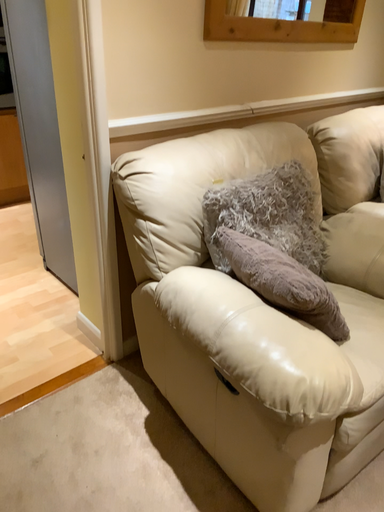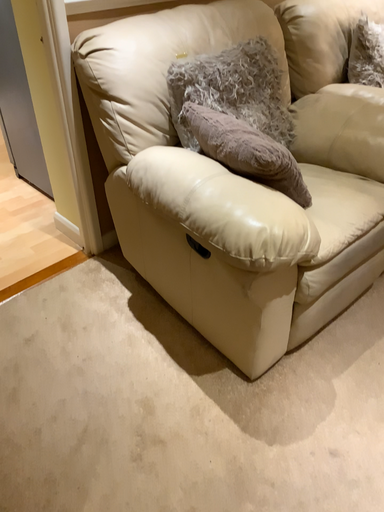
Question: Which way did the camera rotate in the video?

Choices:
 (A) rotated downward
 (B) rotated upward

Answer: (A)